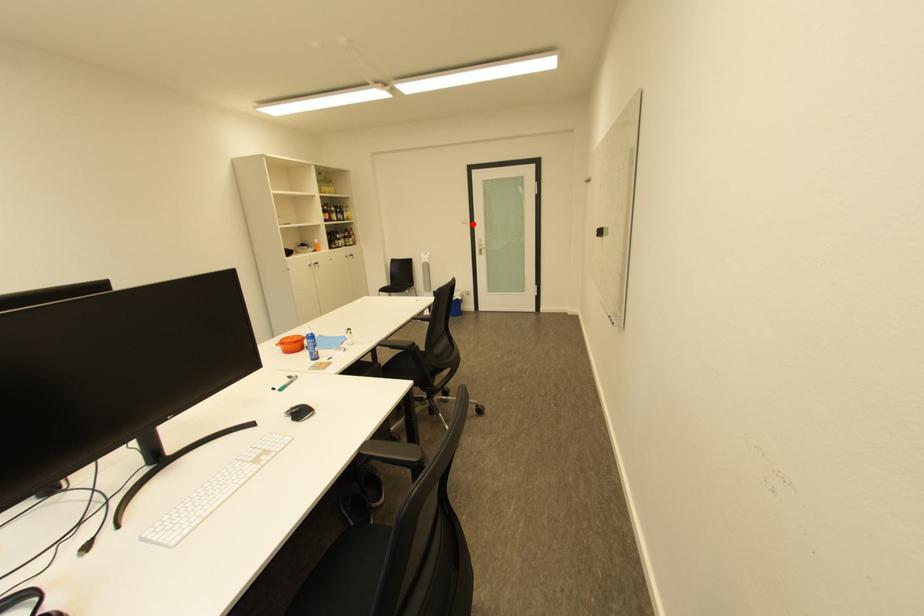
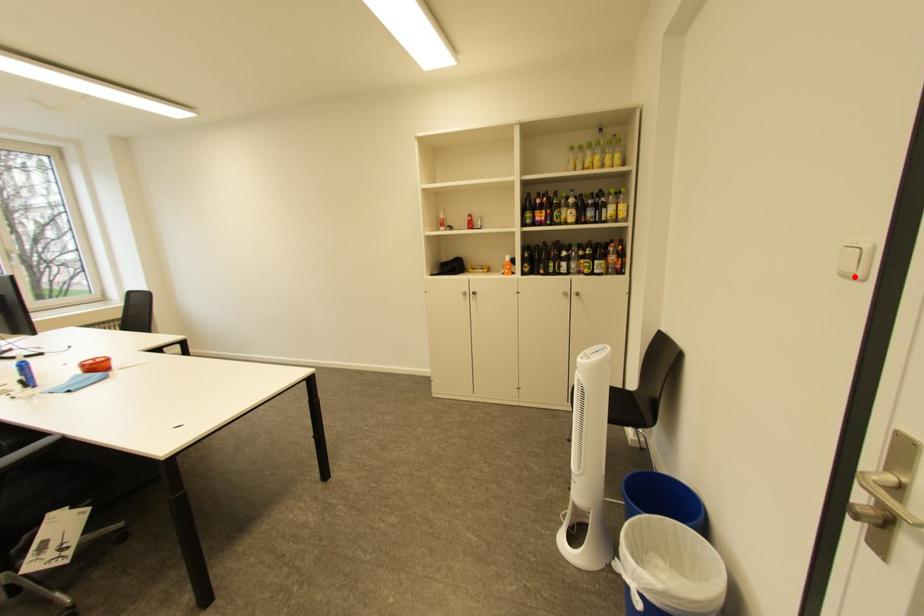
I am providing you with two images of the same scene from different viewpoints. A red point is marked on the first image and another point is marked on the second image. Do the highlighted points in image1 and image2 indicate the same real-world spot?

Yes